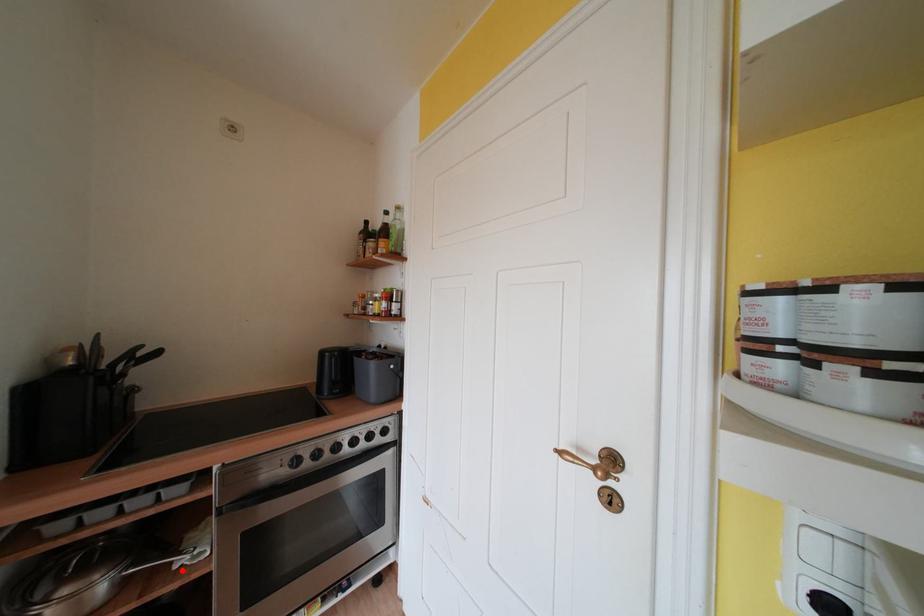
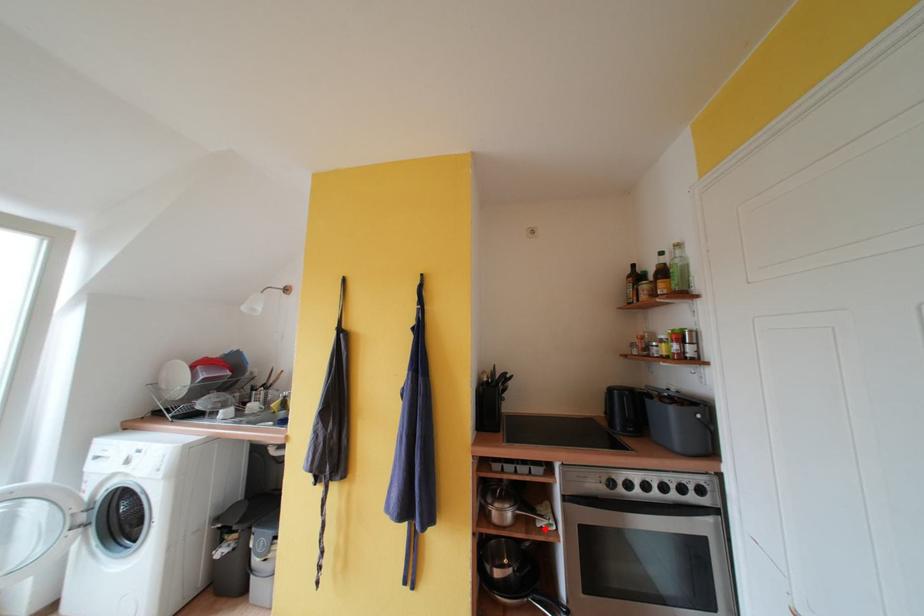
I am providing you with two images of the same scene from different viewpoints. A red point is marked on the first image and another point is marked on the second image. Are the points marked in image1 and image2 representing the same 3D position?

Yes